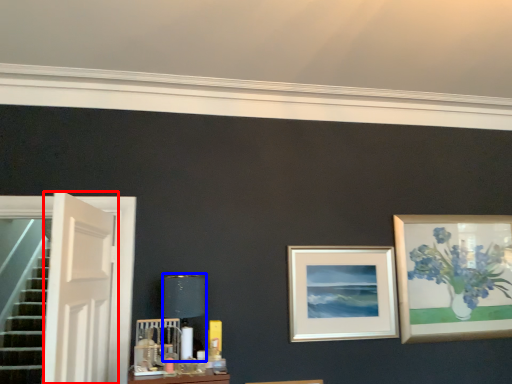
Question: Which point is further to the camera, door (highlighted by a red box) or table lamp (highlighted by a blue box)?

Choices:
 (A) door
 (B) table lamp

Answer: (B)